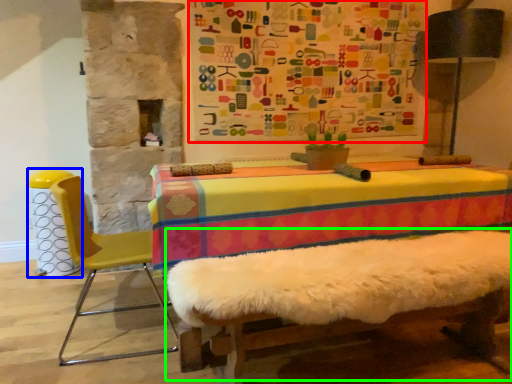
Question: Which object is the farthest from bulletin board (highlighted by a red box)? Choose among these: bar stool (highlighted by a blue box) or bed frame (highlighted by a green box).

Choices:
 (A) bar stool
 (B) bed frame

Answer: (A)